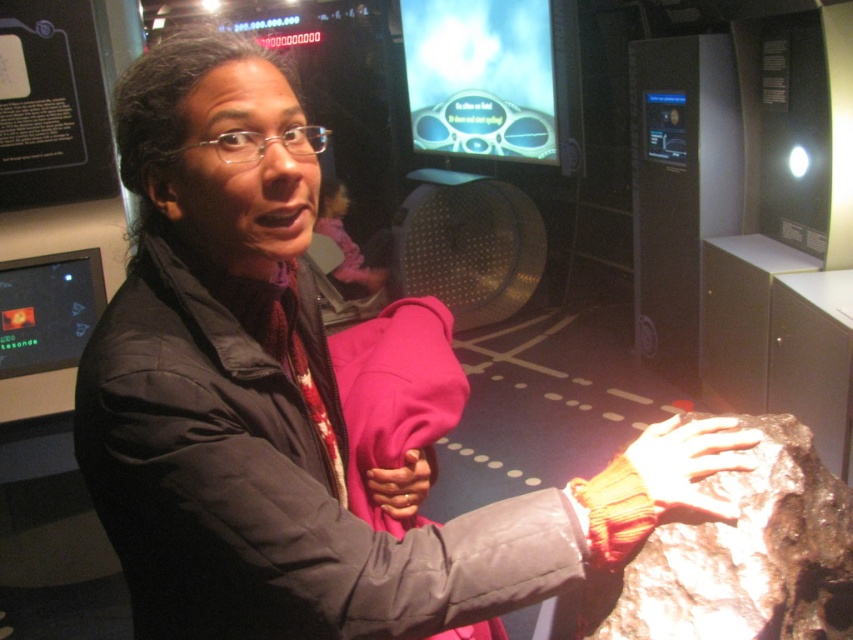
Question: Which point appears closest to the camera in this image?

Choices:
 (A) (378, 474)
 (B) (662, 460)

Answer: (B)

Question: Is black puffy jacket at center wider than sandy brown leather hand at center?

Choices:
 (A) no
 (B) yes

Answer: (B)

Question: Is black puffy jacket at center positioned behind matte orange glove at center?

Choices:
 (A) no
 (B) yes

Answer: (A)

Question: Which of the following is the closest to the observer?

Choices:
 (A) (430, 483)
 (B) (158, 250)
 (C) (656, 424)

Answer: (B)

Question: Does black puffy jacket at center come behind sandy brown leather hand at center?

Choices:
 (A) yes
 (B) no

Answer: (B)

Question: Which of the following is the closest to the observer?

Choices:
 (A) (447, 582)
 (B) (665, 429)
 (C) (407, 476)

Answer: (A)